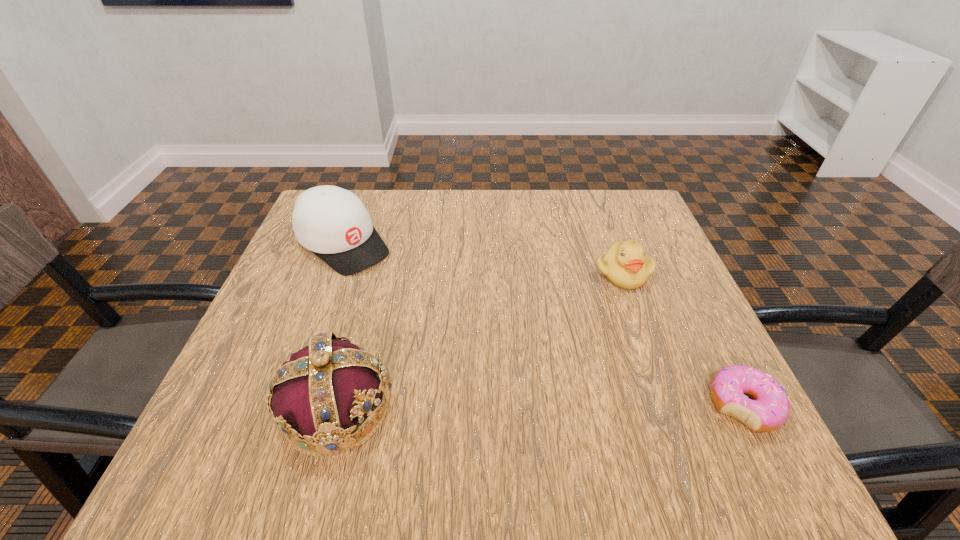
Point out which object is positioned as the second nearest to the baseball cap. Please provide its 2D coordinates. Your answer should be formatted as a tuple, i.e. [(x, y)], where the tuple contains the x and y coordinates of a point satisfying the conditions above.

[(625, 265)]